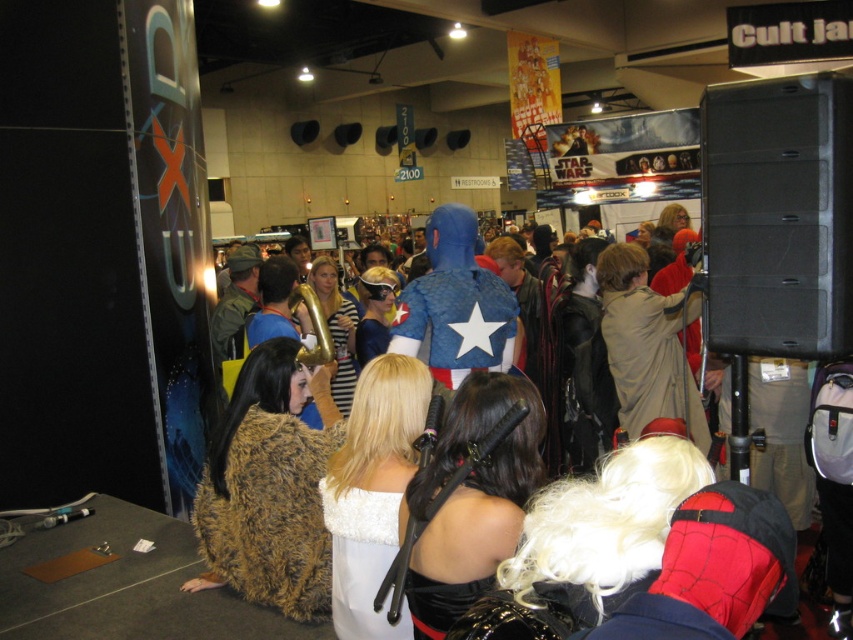
Question: Among these points, which one is nearest to the camera?

Choices:
 (A) (410, 570)
 (B) (650, 362)
 (C) (201, 493)
 (D) (450, 212)

Answer: (A)

Question: Does tan fabric cape at center appear over white furry dress at center?

Choices:
 (A) yes
 (B) no

Answer: (A)

Question: Is fuzzy brown coat at lower left above tan fabric cape at center?

Choices:
 (A) no
 (B) yes

Answer: (A)

Question: Among these objects, which one is nearest to the camera?

Choices:
 (A) white fuzzy coat at center
 (B) furry costume at center
 (C) fuzzy brown coat at lower left
 (D) white furry dress at center

Answer: (A)

Question: Which point is closer to the camera?

Choices:
 (A) white furry dress at center
 (B) fuzzy brown coat at lower left
 (C) black leather gloves at center
 (D) furry costume at center

Answer: (C)

Question: Is black leather gloves at center smaller than fuzzy brown coat at lower left?

Choices:
 (A) no
 (B) yes

Answer: (B)